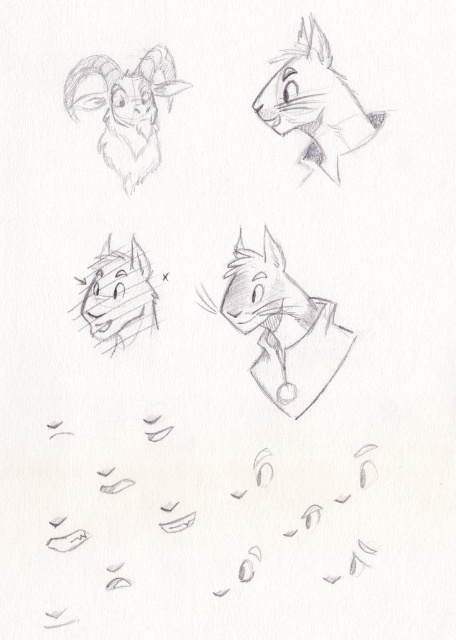
Does smooth gray cat at upper right appear under gray pencil sketch of goat at upper left?

Yes.

Is smooth gray cat at upper right shorter than gray pencil sketch of goat at upper left?

Incorrect, smooth gray cat at upper right's height does not fall short of gray pencil sketch of goat at upper left's.

What do you see at coordinates (316, 102) in the screenshot?
I see `smooth gray cat at upper right` at bounding box center [316, 102].

Identify the location of smooth gray cat at upper right. The height and width of the screenshot is (640, 456). (316, 102).

Does gray pencil sketch of goat at upper left have a greater width compared to smooth gray wolf at center?

Correct, the width of gray pencil sketch of goat at upper left exceeds that of smooth gray wolf at center.

Describe the element at coordinates (127, 108) in the screenshot. I see `gray pencil sketch of goat at upper left` at that location.

At what (x,y) coordinates should I click in order to perform the action: click on gray pencil sketch of goat at upper left. Please return your answer as a coordinate pair (x, y). The image size is (456, 640). Looking at the image, I should click on point(127,108).

Who is lower down, smooth gray cat at center or gray pencil sketch of goat at upper left?

Positioned lower is smooth gray cat at center.

Who is more distant from viewer, (x=269, y=371) or (x=103, y=92)?

Point (x=269, y=371)

Locate an element on the screen. The width and height of the screenshot is (456, 640). smooth gray cat at center is located at coordinates (283, 326).